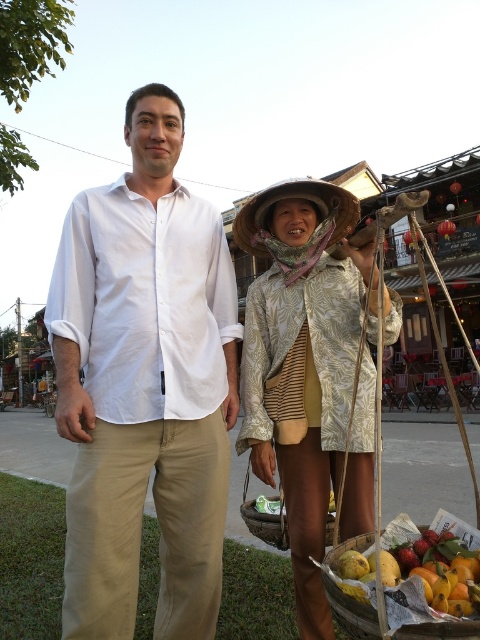
Does white linen shirt at center appear over natural straw hat at center?

Actually, white linen shirt at center is below natural straw hat at center.

Where is `white linen shirt at center`? The image size is (480, 640). white linen shirt at center is located at coordinates (144, 385).

Between point (128, 349) and point (286, 317), which one is positioned in front?

Positioned in front is point (128, 349).

In the scene shown: Is white linen shirt at center positioned in front of printed fabric hat at center?

That is False.

Locate an element on the screen. white linen shirt at center is located at coordinates (144, 385).

I want to click on white linen shirt at center, so click(144, 385).

Which of these two, printed fabric hat at center or shiny yellow mangoes at lower right, stands taller?

printed fabric hat at center is taller.

Is printed fabric hat at center shorter than shiny yellow mangoes at lower right?

No, printed fabric hat at center is not shorter than shiny yellow mangoes at lower right.

Is point (319, 394) positioned behind point (420, 593)?

Yes, it is.

Where is `printed fabric hat at center`? The width and height of the screenshot is (480, 640). printed fabric hat at center is located at coordinates (301, 362).